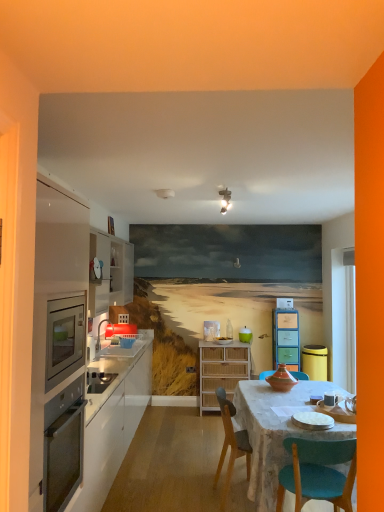
You are a GUI agent. You are given a task and a screenshot of the screen. Output one action in this format:
    pyautogui.click(x=<x>, y=<y>)
    Task: Click on the empty space that is ontop of marble table at center (from a real-world perspective)
    This screenshot has width=384, height=512.
    Given the screenshot: What is the action you would take?
    pyautogui.click(x=301, y=402)